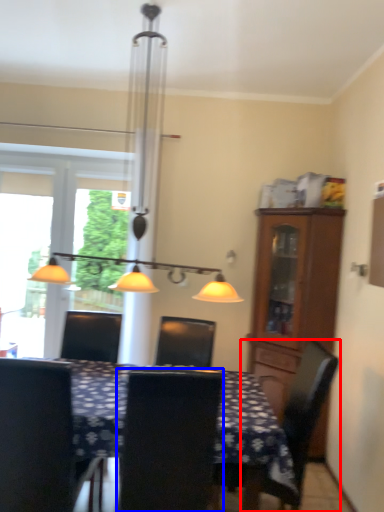
Question: Which of the following is the farthest to the observer, chair (highlighted by a red box) or chair (highlighted by a blue box)?

Choices:
 (A) chair
 (B) chair

Answer: (A)